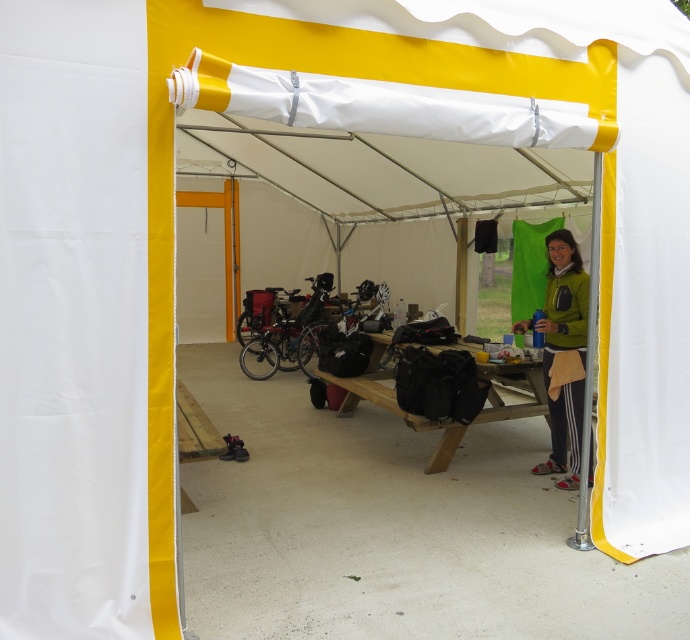
You are setting up a tent and need to decide where to place your items. You have a green fleece jacket at center and a wooden picnic table at center. Which object takes up more space in the tent?

The wooden picnic table at center takes up more space than the green fleece jacket at center because the green fleece jacket at center is smaller than the wooden picnic table at center.

You are organizing a small event in the tent and need to place a 1.5 meter wide banner between the green fleece jacket at center and the wooden picnic table at center. Will there be enough space?

The green fleece jacket at center has a lesser width compared to wooden picnic table at center, but the question is about the space between them. The description only provides information about their widths, not the distance between them. Therefore, it is impossible to determine if the banner will fit based on the given information.

You are setting up a picnic table in a tent and need to place a jacket and a table. According to the scene, where is the green fleece jacket at center in relation to the wooden picnic table at center?

The green fleece jacket at center is to the right of the wooden picnic table at center.